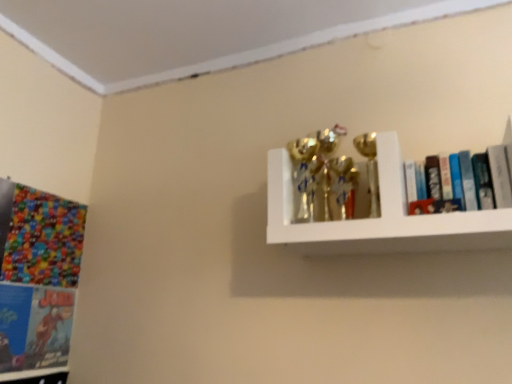
Question: Is hardcover books at upper right, acting as the 2th book starting from the left, turned away from white glossy shelf at upper right?

Choices:
 (A) no
 (B) yes

Answer: (B)

Question: Can you see hardcover books at upper right, which is counted as the 2th book, starting from the bottom, touching white glossy shelf at upper right?

Choices:
 (A) yes
 (B) no

Answer: (B)

Question: Is there a large distance between hardcover books at upper right, which is the first book in top-to-bottom order, and white glossy shelf at upper right?

Choices:
 (A) yes
 (B) no

Answer: (B)

Question: From a real-world perspective, is hardcover books at upper right, which appears as the 2th book when viewed from the back, physically above white glossy shelf at upper right?

Choices:
 (A) yes
 (B) no

Answer: (A)

Question: From the image's perspective, is hardcover books at upper right, arranged as the first book when viewed from the right, below white glossy shelf at upper right?

Choices:
 (A) yes
 (B) no

Answer: (B)

Question: Is point (13, 367) closer or farther from the camera than point (436, 210)?

Choices:
 (A) closer
 (B) farther

Answer: (B)

Question: Looking at their shapes, would you say matte blue book at lower left, placed as the second book when sorted from front to back, is wider or thinner than hardcover books at upper right, which is the first book in top-to-bottom order?

Choices:
 (A) thin
 (B) wide

Answer: (A)

Question: Considering the positions of matte blue book at lower left, acting as the 2th book starting from the top, and hardcover books at upper right, which appears as the 2th book when viewed from the back, in the image, is matte blue book at lower left, acting as the 2th book starting from the top, taller or shorter than hardcover books at upper right, which appears as the 2th book when viewed from the back,?

Choices:
 (A) tall
 (B) short

Answer: (A)

Question: Choose the correct answer: Is matte blue book at lower left, acting as the 2th book starting from the top, inside hardcover books at upper right, the 1th book when ordered from front to back, or outside it?

Choices:
 (A) outside
 (B) inside

Answer: (A)

Question: In the image, is multicolored glossy comic book at left positioned in front of or behind hardcover books at upper right, the 1th book when ordered from front to back?

Choices:
 (A) front
 (B) behind

Answer: (B)

Question: Considering the positions of multicolored glossy comic book at left and hardcover books at upper right, which is counted as the 2th book, starting from the bottom, in the image, is multicolored glossy comic book at left taller or shorter than hardcover books at upper right, which is counted as the 2th book, starting from the bottom,?

Choices:
 (A) tall
 (B) short

Answer: (A)

Question: Is multicolored glossy comic book at left bigger or smaller than hardcover books at upper right, which is the first book in top-to-bottom order?

Choices:
 (A) big
 (B) small

Answer: (B)

Question: Visually, is multicolored glossy comic book at left positioned to the left or to the right of hardcover books at upper right, the 1th book when ordered from front to back?

Choices:
 (A) right
 (B) left

Answer: (B)

Question: From a real-world perspective, is multicolored glossy comic book at left positioned above or below white glossy shelf at upper right?

Choices:
 (A) below
 (B) above

Answer: (A)

Question: Based on their positions, is multicolored glossy comic book at left located to the left or right of white glossy shelf at upper right?

Choices:
 (A) right
 (B) left

Answer: (B)